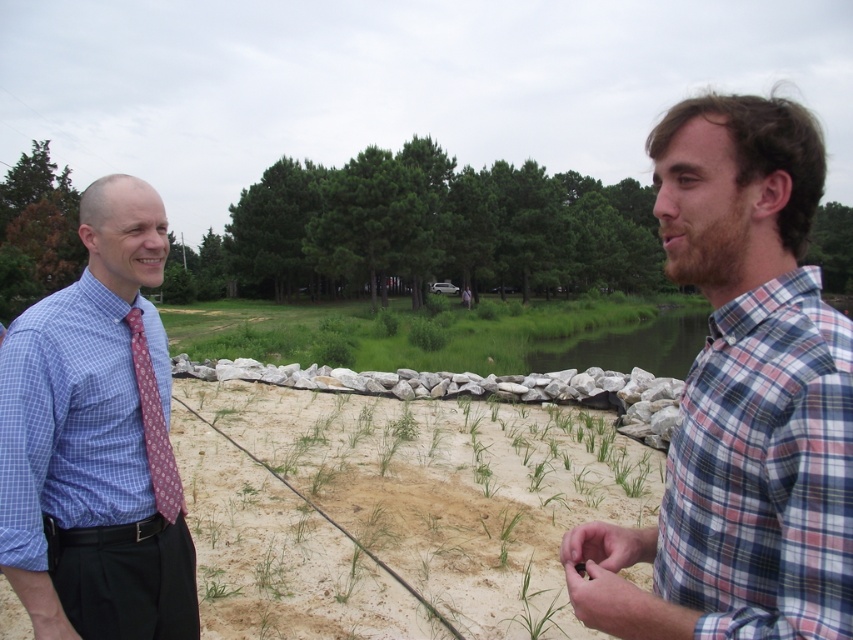
Question: Which point is farther to the camera?

Choices:
 (A) plaid cotton shirt at center
 (B) green smooth water at center

Answer: (B)

Question: Is plaid cotton shirt at center above maroon printed tie at left?

Choices:
 (A) yes
 (B) no

Answer: (A)

Question: Which is nearer to the plaid cotton shirt at center?

Choices:
 (A) plaid fabric shirt at right
 (B) maroon printed tie at left

Answer: (A)

Question: Which object is positioned farthest from the plaid cotton shirt at center?

Choices:
 (A) maroon printed tie at left
 (B) green smooth water at center

Answer: (B)

Question: Observing the image, what is the correct spatial positioning of green smooth water at center in reference to maroon printed tie at left?

Choices:
 (A) above
 (B) below

Answer: (A)

Question: Can you confirm if blue checkered shirt at left is thinner than maroon printed tie at left?

Choices:
 (A) no
 (B) yes

Answer: (A)